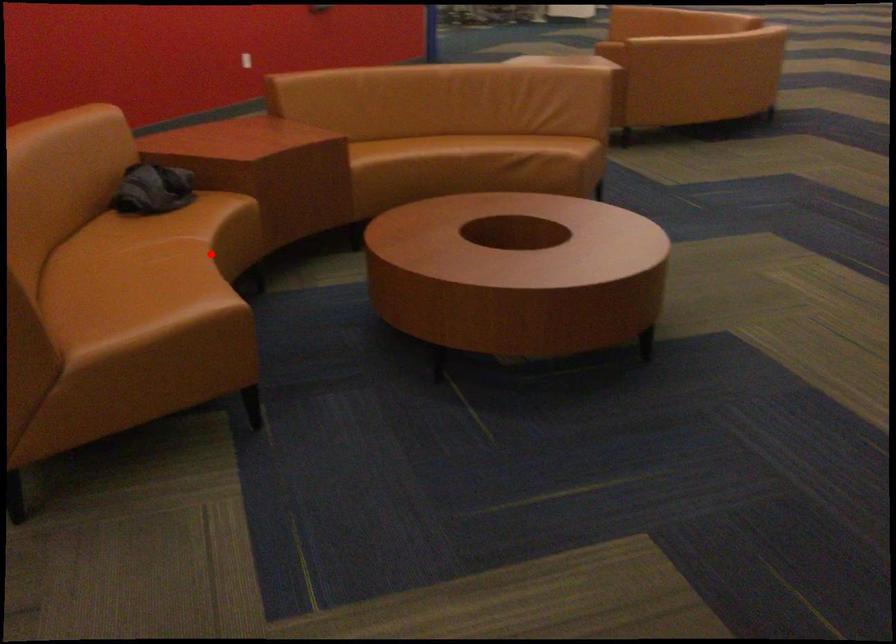
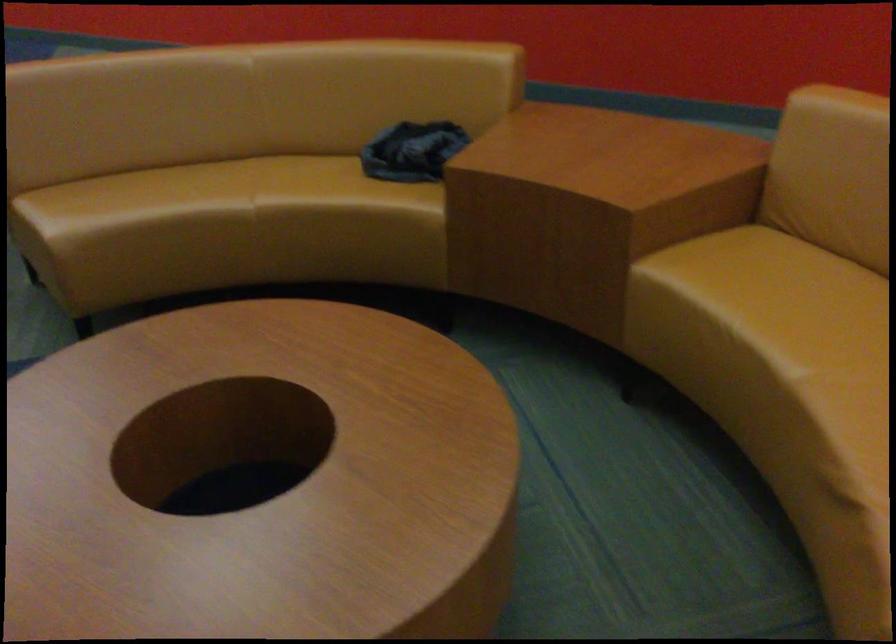
The point at the highlighted location is marked in the first image. Where is the corresponding point in the second image?

(255, 220)